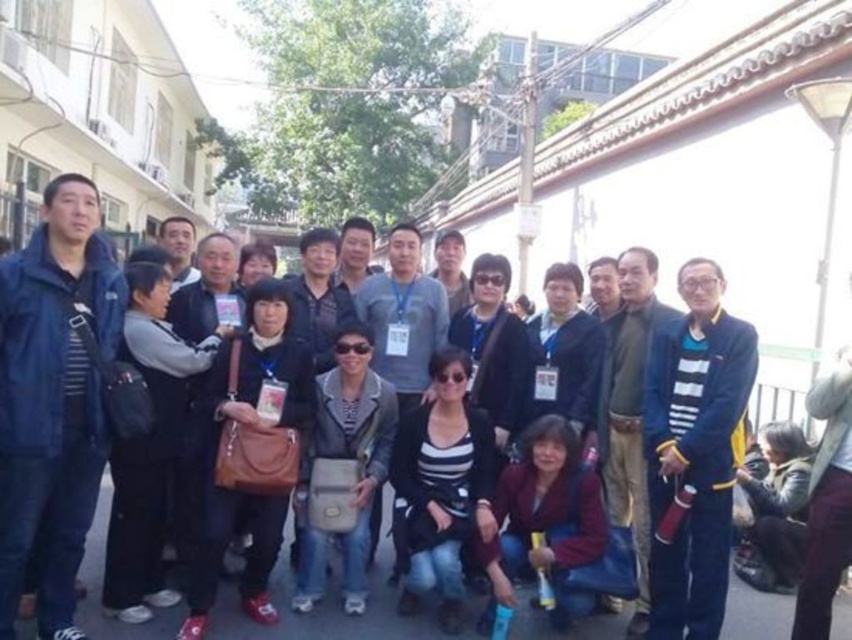
Question: Which of the following is the farthest from the observer?

Choices:
 (A) dark red fabric jacket at lower center
 (B) leather-like gray bag at center
 (C) black striped shirt at center

Answer: (B)

Question: Based on their relative distances, which object is nearer to the black striped shirt at center?

Choices:
 (A) dark red fabric jacket at lower center
 (B) leather-like gray bag at center

Answer: (A)

Question: Does dark red fabric jacket at lower center come in front of leather-like gray bag at center?

Choices:
 (A) yes
 (B) no

Answer: (A)

Question: Considering the relative positions of black striped shirt at center and dark red fabric jacket at lower center in the image provided, where is black striped shirt at center located with respect to dark red fabric jacket at lower center?

Choices:
 (A) left
 (B) right

Answer: (A)

Question: Which object is farther from the camera taking this photo?

Choices:
 (A) black striped shirt at center
 (B) leather-like gray bag at center
 (C) dark red fabric jacket at lower center

Answer: (B)

Question: Does black striped shirt at center have a lesser width compared to leather-like gray bag at center?

Choices:
 (A) yes
 (B) no

Answer: (B)